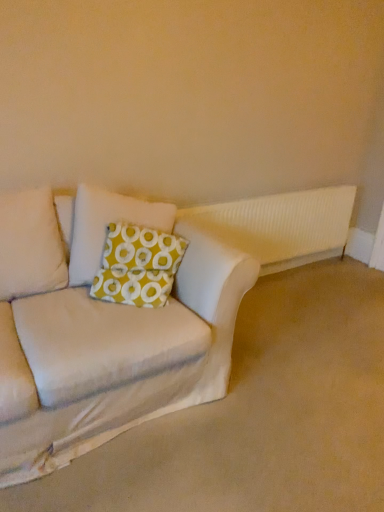
Question: From a real-world perspective, is green fabric pillow at center on top of beige fabric couch at lower left?

Choices:
 (A) no
 (B) yes

Answer: (B)

Question: From the image's perspective, is green fabric pillow at center over beige fabric couch at lower left?

Choices:
 (A) yes
 (B) no

Answer: (A)

Question: Is green fabric pillow at center further to the viewer compared to beige fabric couch at lower left?

Choices:
 (A) no
 (B) yes

Answer: (B)

Question: Does green fabric pillow at center appear on the right side of beige fabric couch at lower left?

Choices:
 (A) yes
 (B) no

Answer: (B)

Question: Is beige fabric couch at lower left at the back of green fabric pillow at center?

Choices:
 (A) no
 (B) yes

Answer: (A)

Question: From the image's perspective, does green fabric pillow at center appear lower than beige fabric couch at lower left?

Choices:
 (A) yes
 (B) no

Answer: (B)

Question: Is green fabric pillow at center taller than white ribbed radiator at upper right?

Choices:
 (A) no
 (B) yes

Answer: (A)

Question: From a real-world perspective, is green fabric pillow at center on white ribbed radiator at upper right?

Choices:
 (A) yes
 (B) no

Answer: (A)

Question: Is green fabric pillow at center next to white ribbed radiator at upper right?

Choices:
 (A) yes
 (B) no

Answer: (B)

Question: Is green fabric pillow at center completely or partially outside of white ribbed radiator at upper right?

Choices:
 (A) no
 (B) yes

Answer: (B)

Question: Does green fabric pillow at center turn towards white ribbed radiator at upper right?

Choices:
 (A) no
 (B) yes

Answer: (A)

Question: From the image's perspective, is green fabric pillow at center above white ribbed radiator at upper right?

Choices:
 (A) no
 (B) yes

Answer: (A)

Question: Is beige fabric couch at lower left located outside white ribbed radiator at upper right?

Choices:
 (A) no
 (B) yes

Answer: (B)